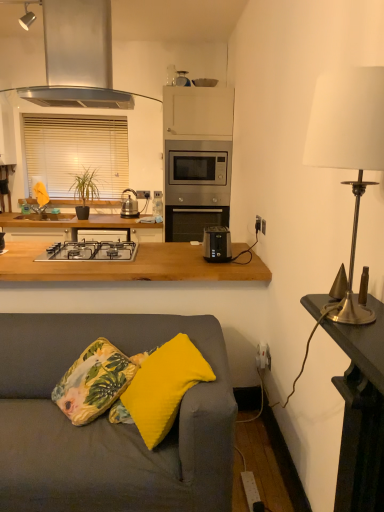
Locate an element on the screen. This screenshot has width=384, height=512. free location in front of gold metallic lamp at right, marked as the first appliance in a front-to-back arrangement is located at coordinates (345, 318).